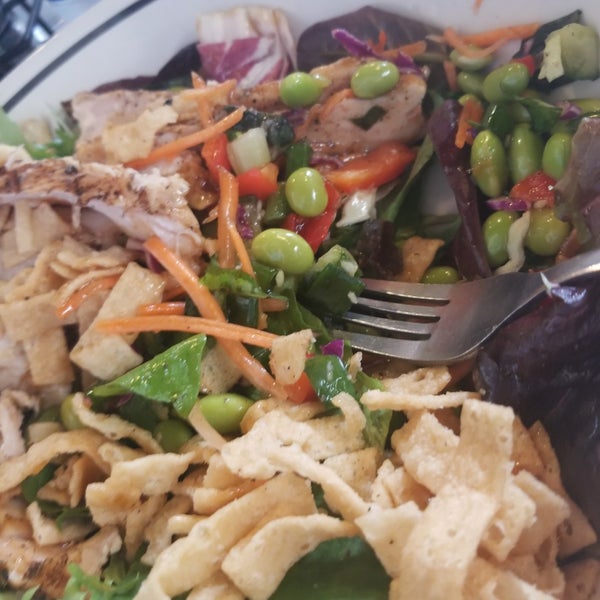
The width and height of the screenshot is (600, 600). I want to click on plate, so click(142, 53).